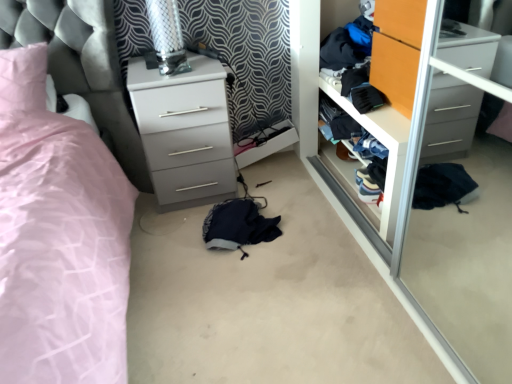
Question: Is navy blue fabric at center wider than white glossy chest of drawers at center?

Choices:
 (A) yes
 (B) no

Answer: (B)

Question: Is navy blue fabric at center not inside white glossy chest of drawers at center?

Choices:
 (A) yes
 (B) no

Answer: (A)

Question: From a real-world perspective, does navy blue fabric at center stand above white glossy chest of drawers at center?

Choices:
 (A) no
 (B) yes

Answer: (A)

Question: Is navy blue fabric at center closer to the viewer compared to white glossy chest of drawers at center?

Choices:
 (A) yes
 (B) no

Answer: (A)

Question: Is navy blue fabric at center directly adjacent to white glossy chest of drawers at center?

Choices:
 (A) yes
 (B) no

Answer: (B)

Question: Is navy blue fabric at center taller than white glossy chest of drawers at center?

Choices:
 (A) no
 (B) yes

Answer: (A)

Question: Considering the relative positions of orange wood wardrobe at center and wooden closet door at center in the image provided, is orange wood wardrobe at center behind wooden closet door at center?

Choices:
 (A) no
 (B) yes

Answer: (A)

Question: From a real-world perspective, is orange wood wardrobe at center beneath wooden closet door at center?

Choices:
 (A) yes
 (B) no

Answer: (B)

Question: From the image's perspective, does orange wood wardrobe at center appear lower than wooden closet door at center?

Choices:
 (A) no
 (B) yes

Answer: (A)

Question: Is orange wood wardrobe at center far away from wooden closet door at center?

Choices:
 (A) yes
 (B) no

Answer: (B)

Question: Considering the relative sizes of orange wood wardrobe at center and wooden closet door at center in the image provided, is orange wood wardrobe at center taller than wooden closet door at center?

Choices:
 (A) no
 (B) yes

Answer: (A)

Question: Does orange wood wardrobe at center touch wooden closet door at center?

Choices:
 (A) no
 (B) yes

Answer: (A)

Question: Is white glossy chest of drawers at center not within wooden closet door at center?

Choices:
 (A) no
 (B) yes

Answer: (B)